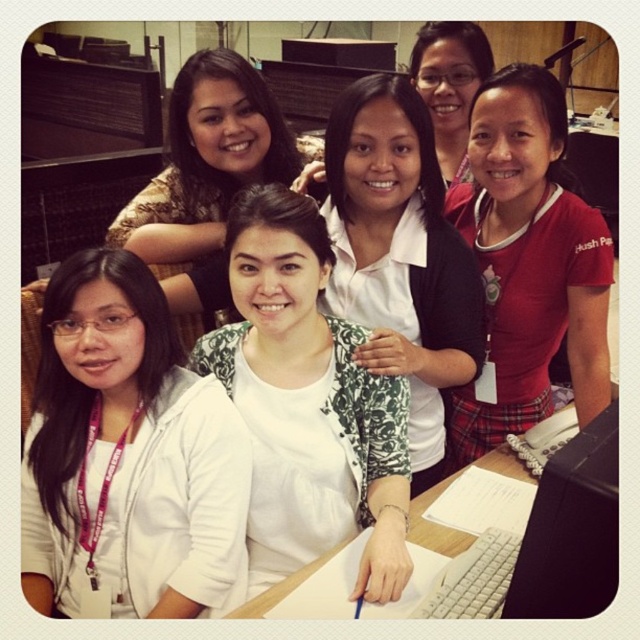
In the scene shown: You are a photographer setting up for a group photo in an office scene. You need to place a small tripod between the black plastic monitor at lower right and the wooden desk at lower center. Based on their positions, will the tripod be closer to the monitor or the desk?

The black plastic monitor at lower right is closer to the viewer than the wooden desk at lower center, so the tripod placed between them will be closer to the wooden desk at lower center.

You are a delivery person who needs to place a small package on the wooden desk at lower center. You are currently standing next to the white matte jacket at lower left. Can you reach the desk without moving your feet?

The distance between the white matte jacket at lower left and the wooden desk at lower center is 15.91 inches. Since this distance is very short, you can easily reach the desk without moving your feet.